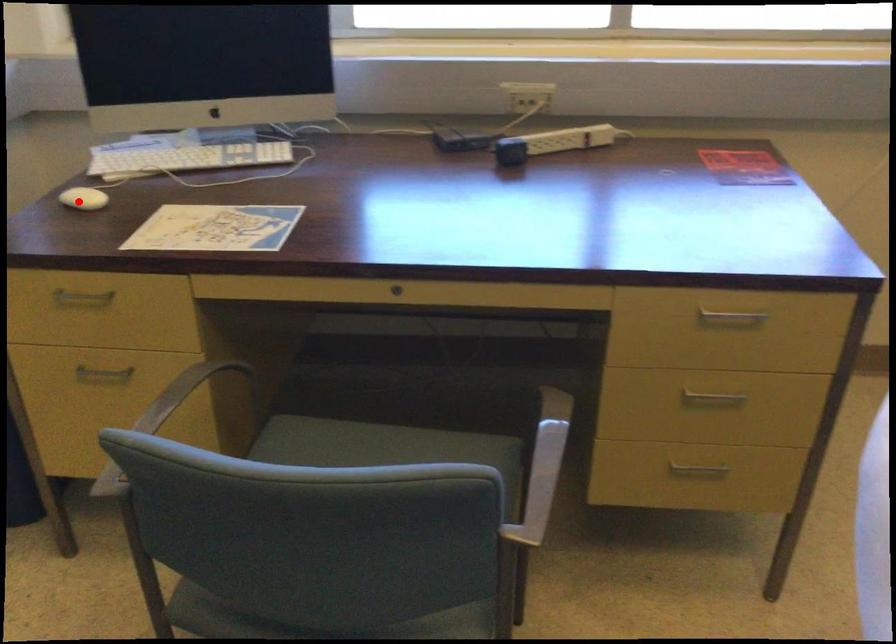
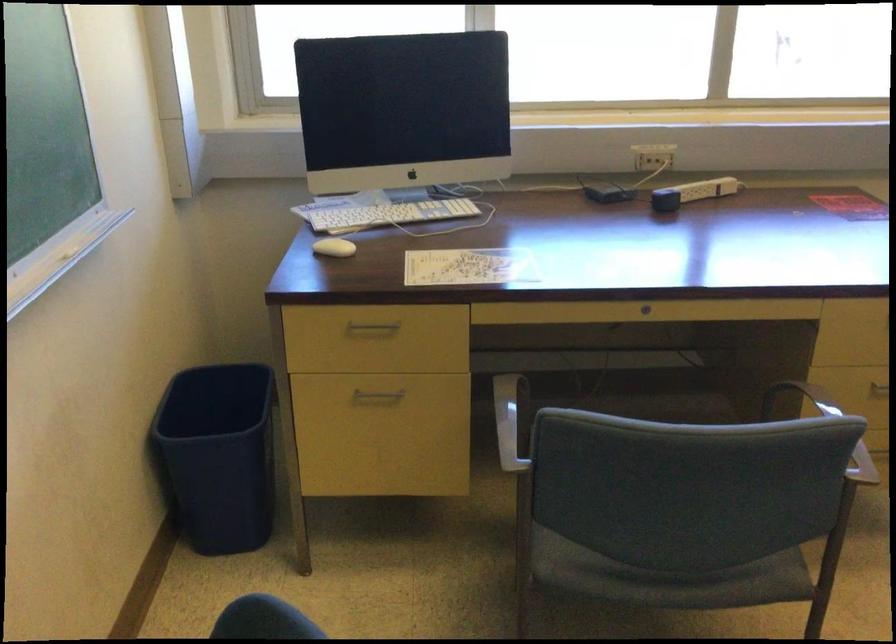
The point at the highlighted location is marked in the first image. Where is the corresponding point in the second image?

(333, 247)